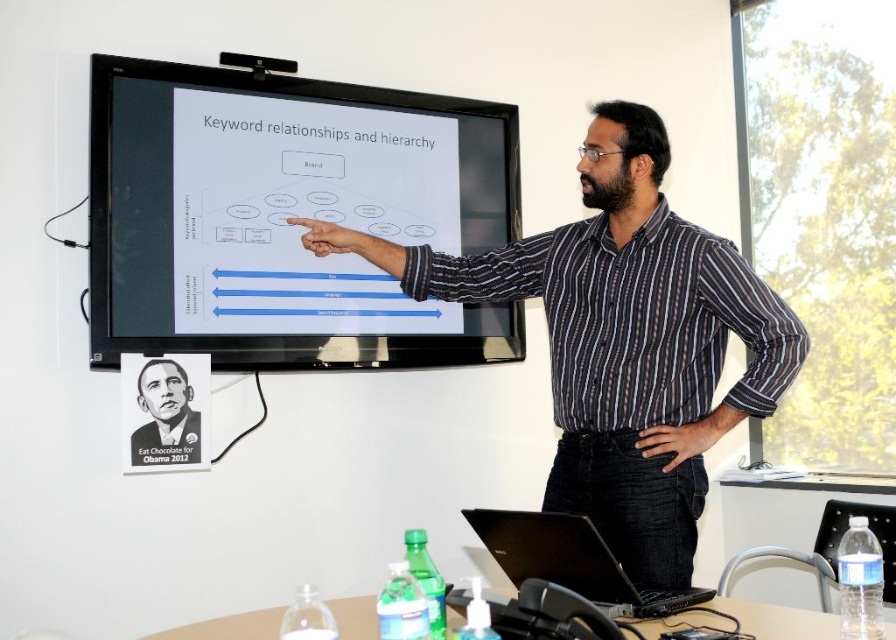
You are standing in the room where the presentation is taking place. You notice two points on the large screen. The first point is at coordinates point (570, 536) and the second point is at point (178, 380). Which point is closer to you?

Point (570, 536) is closer to the camera than point (178, 380).

You are an attendee at a presentation. You notice two black items in the scene. One is the black striped shirt at center and the other is the black paper poster at upper left. Which black item is positioned higher up in the image?

The black striped shirt at center is located above the black paper poster at upper left, so the black striped shirt at center is positioned higher up in the image.

Based on the scene description, where is the black striped shirt at center located in terms of its 2D coordinates?

The black striped shirt at center is located at the 2D coordinates point [623,340].